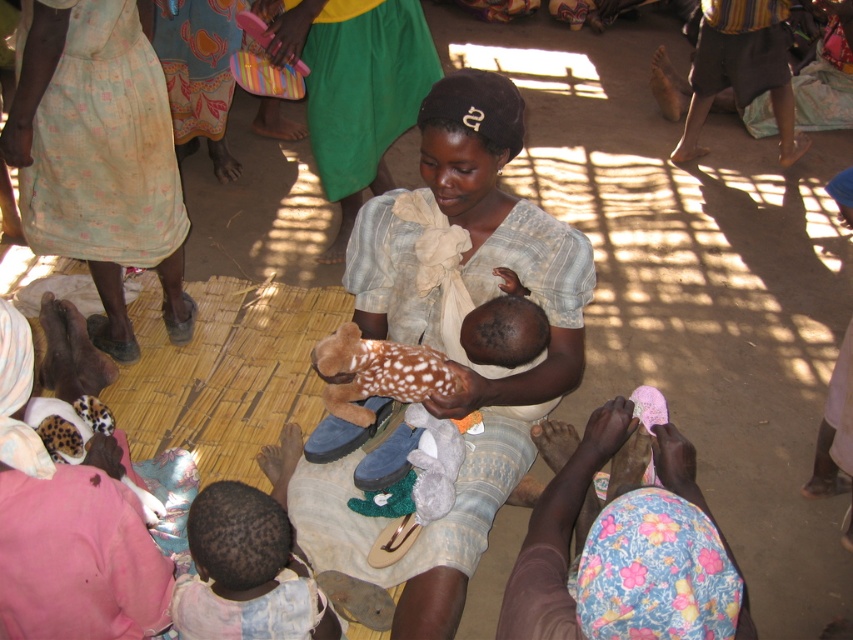
Based on the photo, is dark skin baby at lower left closer to the viewer compared to brown plush toy at center?

Yes, it is in front of brown plush toy at center.

Who is more forward, (202, 588) or (415, 401)?

Point (202, 588) is more forward.

I want to click on dark skin baby at lower left, so point(250,561).

The height and width of the screenshot is (640, 853). Identify the location of dark skin baby at lower left. (250, 561).

What do you see at coordinates (456, 337) in the screenshot?
I see `matte fabric baby at center` at bounding box center [456, 337].

Does point (480, 372) come closer to viewer compared to point (318, 353)?

No, (480, 372) is further to viewer.

Is point (477, 212) positioned behind point (329, 356)?

That is True.

Find the location of a particular element. matte fabric baby at center is located at coordinates (456, 337).

Which is more to the left, light beige cotton dress at upper left or brown plush toy at center?

From the viewer's perspective, light beige cotton dress at upper left appears more on the left side.

Does light beige cotton dress at upper left appear under brown plush toy at center?

Incorrect, light beige cotton dress at upper left is not positioned below brown plush toy at center.

Is point (152, 132) positioned before point (355, 340)?

That is False.

Locate an element on the screen. The width and height of the screenshot is (853, 640). light beige cotton dress at upper left is located at coordinates (97, 156).